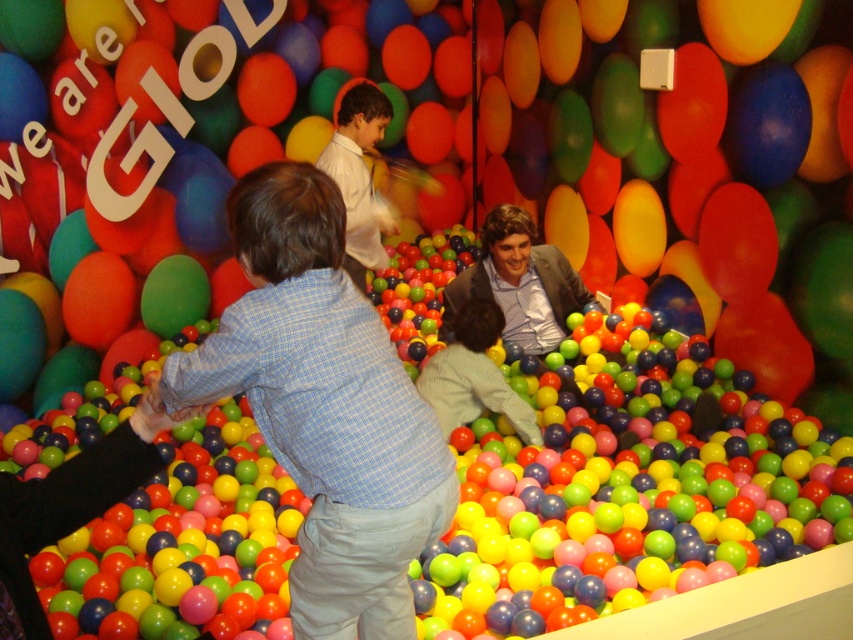
Question: Can you confirm if blue checkered shirt at center is positioned to the right of white glossy shirt at center?

Choices:
 (A) no
 (B) yes

Answer: (B)

Question: Which point is farther to the camera?

Choices:
 (A) white glossy shirt at center
 (B) light brown leather jacket at center

Answer: (A)

Question: Which of the following is the farthest from the observer?

Choices:
 (A) light green fabric shirt at center
 (B) light brown leather jacket at center

Answer: (B)

Question: Can you confirm if blue checkered shirt at center is smaller than light brown leather jacket at center?

Choices:
 (A) yes
 (B) no

Answer: (B)

Question: Which of these objects is positioned closest to the light brown leather jacket at center?

Choices:
 (A) blue checkered shirt at center
 (B) white glossy shirt at center
 (C) light green fabric shirt at center

Answer: (C)

Question: Can you confirm if light brown leather jacket at center is wider than white glossy shirt at center?

Choices:
 (A) yes
 (B) no

Answer: (A)